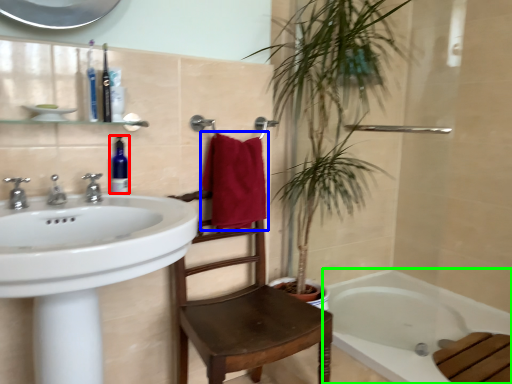
Question: Considering the real-world distances, which object is farthest from soap dispenser (highlighted by a red box)? bath towel (highlighted by a blue box) or bathtub (highlighted by a green box)?

Choices:
 (A) bath towel
 (B) bathtub

Answer: (B)